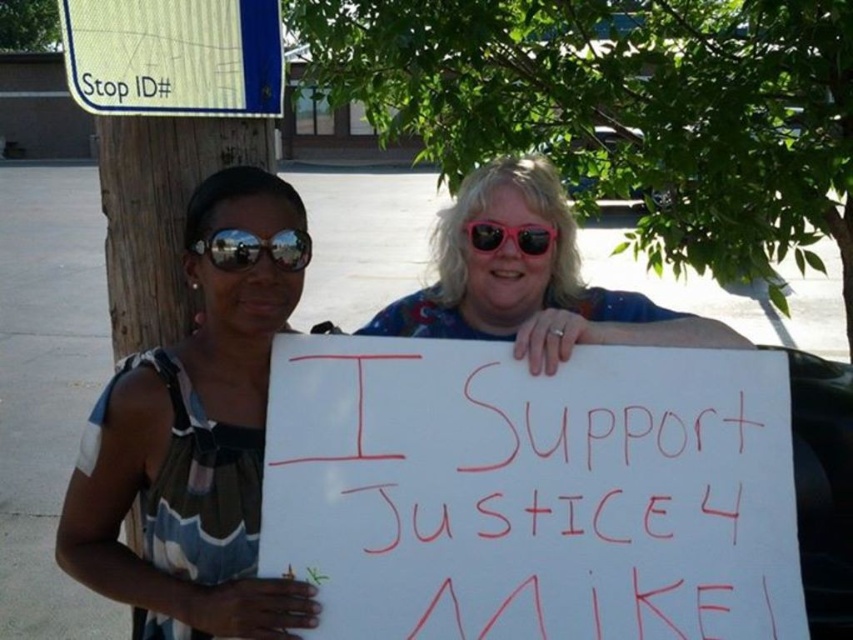
Consider the image. Which is more to the left, white paper sign at center or reflective plastic goggles at center?

reflective plastic goggles at center

At what (x,y) coordinates should I click in order to perform the action: click on white paper sign at center. Please return your answer as a coordinate pair (x, y). Looking at the image, I should click on (531, 492).

Looking at this image, can you confirm if green striped street sign at upper left is positioned below pink reflective sunglasses at center?

Incorrect, green striped street sign at upper left is not positioned below pink reflective sunglasses at center.

Is green striped street sign at upper left closer to the viewer compared to pink reflective sunglasses at center?

Yes, green striped street sign at upper left is in front of pink reflective sunglasses at center.

I want to click on green striped street sign at upper left, so click(173, 56).

Which is behind, point (257, 332) or point (482, 241)?

Positioned behind is point (482, 241).

Who is positioned more to the right, matte black sunglasses at left or pink reflective sunglasses at center?

From the viewer's perspective, pink reflective sunglasses at center appears more on the right side.

Locate an element on the screen. The width and height of the screenshot is (853, 640). matte black sunglasses at left is located at coordinates (194, 444).

The image size is (853, 640). In order to click on matte black sunglasses at left in this screenshot , I will do `click(194, 444)`.